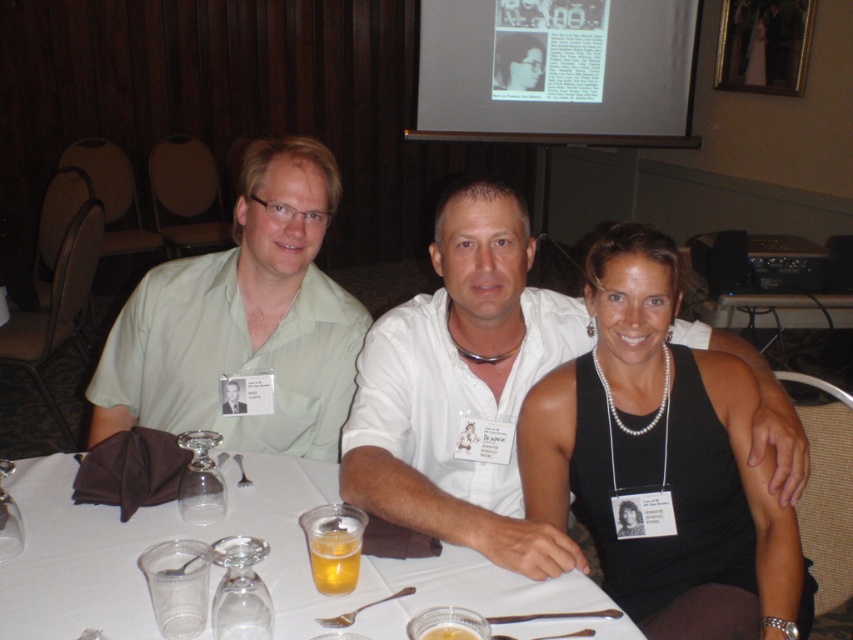
Question: Does black satin tank top at center come in front of green matte shirt at left?

Choices:
 (A) yes
 (B) no

Answer: (A)

Question: Does black satin tank top at center have a lesser width compared to white paper table at center?

Choices:
 (A) yes
 (B) no

Answer: (A)

Question: Which is nearer to the green matte shirt at left?

Choices:
 (A) white paper table at center
 (B) black satin tank top at center

Answer: (A)

Question: Which of the following is the closest to the observer?

Choices:
 (A) (714, 477)
 (B) (286, 243)
 (C) (84, 536)

Answer: (C)

Question: Does green matte shirt at left have a larger size compared to white paper table at center?

Choices:
 (A) no
 (B) yes

Answer: (B)

Question: Which of the following is the closest to the observer?

Choices:
 (A) white paper table at center
 (B) green matte shirt at left

Answer: (A)